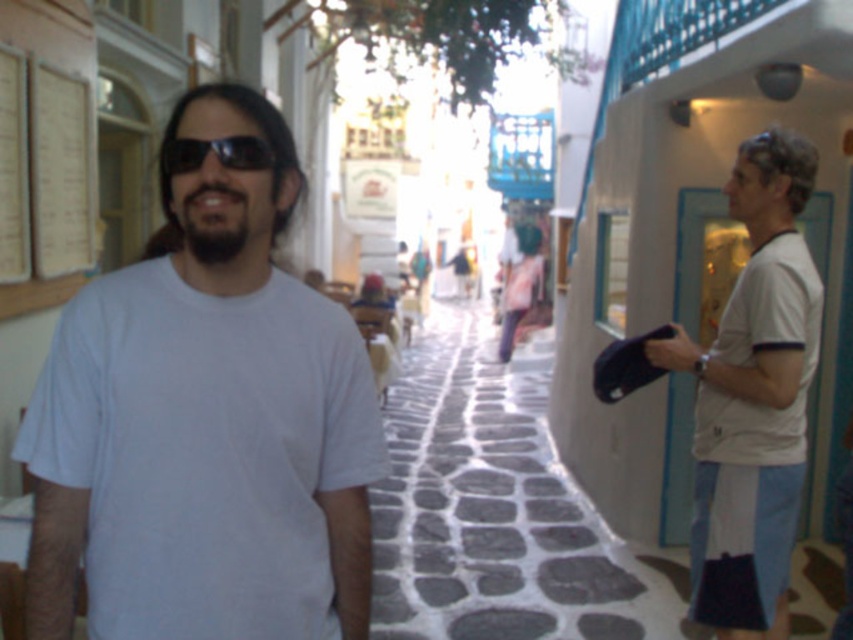
Is white cotton shirt at right taller than white paper at left?

Yes.

What do you see at coordinates (753, 397) in the screenshot? Image resolution: width=853 pixels, height=640 pixels. I see `white cotton shirt at right` at bounding box center [753, 397].

Where is `white cotton shirt at right`? This screenshot has height=640, width=853. white cotton shirt at right is located at coordinates (753, 397).

Is white matte t-shirt at center shorter than white cotton shirt at right?

Yes.

Between white matte t-shirt at center and white cotton shirt at right, which one has more height?

white cotton shirt at right

This screenshot has height=640, width=853. I want to click on white matte t-shirt at center, so click(x=206, y=422).

Is point (68, 3) farther from viewer compared to point (252, 168)?

Yes, it is.

Locate an element on the screen. white paper at left is located at coordinates (51, 32).